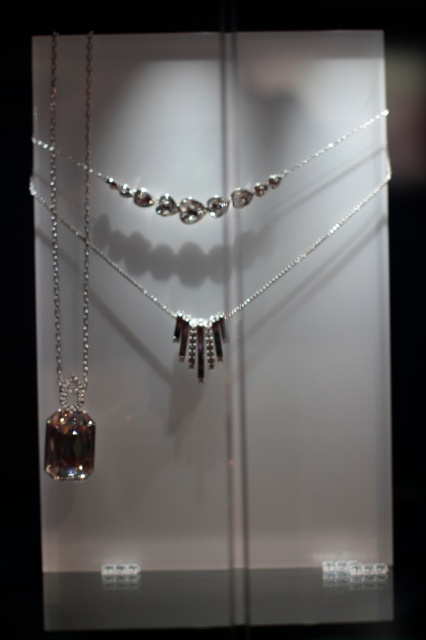
You are a customer in a jewelry store looking at the display. You want to choose a necklace that is larger in size. Which one should you pick between the shiny silver necklace at center and the silver metallic chain at left?

The shiny silver necklace at center is bigger than the silver metallic chain at left, so you should pick the shiny silver necklace at center.

Consider the image. You are a customer in a jewelry store and want to examine both the shiny silver chain at left and the silver metallic chain at left. Which one can you see more clearly from your current position?

The shiny silver chain at left is closer to the viewer, so it can be seen more clearly than the silver metallic chain at left.